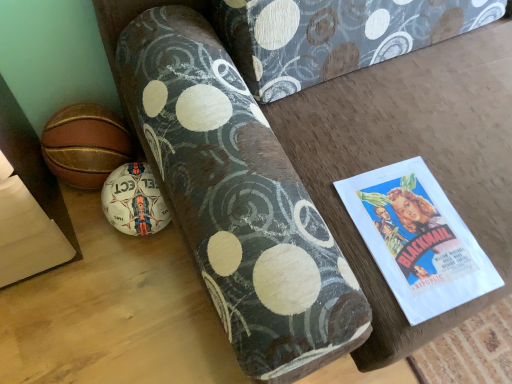
Question: From a real-world perspective, relative to white matte soccer ball at lower left, the second ball in the top-to-bottom sequence, is leather basketball at lower left, placed as the first ball when sorted from top to bottom, vertically above or below?

Choices:
 (A) above
 (B) below

Answer: (A)

Question: From their relative heights in the image, would you say leather basketball at lower left, arranged as the second ball when ordered from the bottom, is taller or shorter than white matte soccer ball at lower left, marked as the first ball in a bottom-to-top arrangement?

Choices:
 (A) short
 (B) tall

Answer: (A)

Question: Would you say leather basketball at lower left, arranged as the second ball when ordered from the bottom, is to the left or to the right of white matte soccer ball at lower left, marked as the first ball in a bottom-to-top arrangement, in the picture?

Choices:
 (A) right
 (B) left

Answer: (B)

Question: Looking at the image, does white matte soccer ball at lower left, the second ball in the top-to-bottom sequence, seem bigger or smaller compared to leather basketball at lower left, placed as the first ball when sorted from top to bottom?

Choices:
 (A) small
 (B) big

Answer: (A)

Question: Does point (147, 180) appear closer or farther from the camera than point (65, 110)?

Choices:
 (A) farther
 (B) closer

Answer: (B)

Question: In terms of width, does white matte soccer ball at lower left, the second ball in the top-to-bottom sequence, look wider or thinner when compared to leather basketball at lower left, arranged as the second ball when ordered from the bottom?

Choices:
 (A) wide
 (B) thin

Answer: (A)

Question: From the image's perspective, is white matte soccer ball at lower left, the second ball in the top-to-bottom sequence, above or below leather basketball at lower left, arranged as the second ball when ordered from the bottom?

Choices:
 (A) below
 (B) above

Answer: (A)